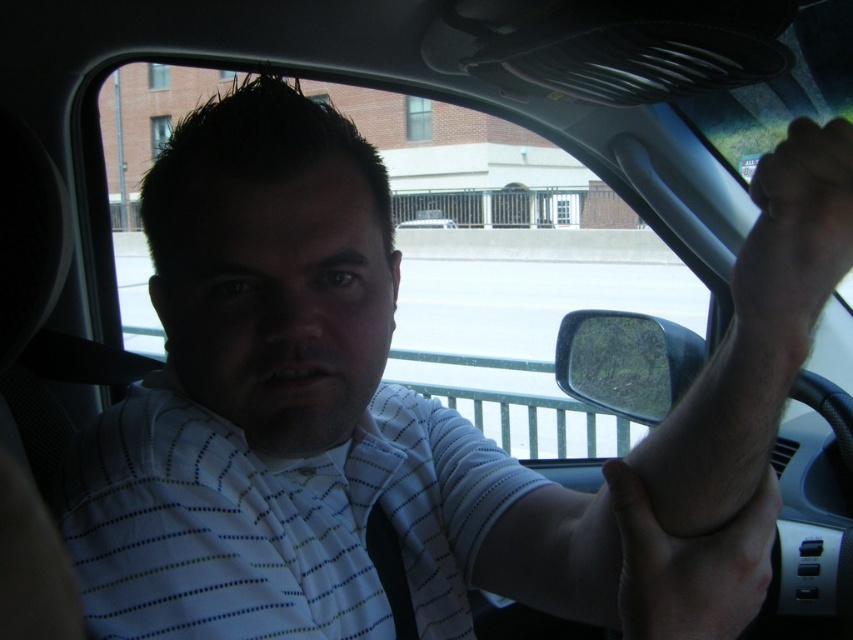
Question: Which object appears closest to the camera in this image?

Choices:
 (A) dark skin/hair at upper right
 (B) white dotted fabric shirt at center
 (C) clear plastic side mirror at right
 (D) smooth skin hand at center

Answer: (A)

Question: Can you confirm if dark skin/hair at upper right is thinner than clear plastic side mirror at right?

Choices:
 (A) no
 (B) yes

Answer: (B)

Question: Estimate the real-world distances between objects in this image. Which object is closer to the white dotted fabric shirt at center?

Choices:
 (A) white matte car at center
 (B) clear plastic side mirror at right

Answer: (B)

Question: Does dark skin/hair at upper right have a greater width compared to white matte car at center?

Choices:
 (A) no
 (B) yes

Answer: (A)

Question: Observing the image, what is the correct spatial positioning of white dotted fabric shirt at center in reference to dark skin/hair at upper right?

Choices:
 (A) right
 (B) left

Answer: (B)

Question: Among these objects, which one is farthest from the camera?

Choices:
 (A) smooth skin hand at center
 (B) dark skin/hair at upper right

Answer: (A)